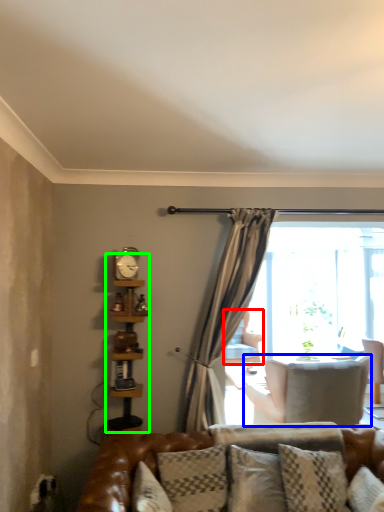
Question: Based on their relative distances, which object is farther from chair (highlighted by a red box)? Choose from chair (highlighted by a blue box) and bookshelf (highlighted by a green box).

Choices:
 (A) chair
 (B) bookshelf

Answer: (B)